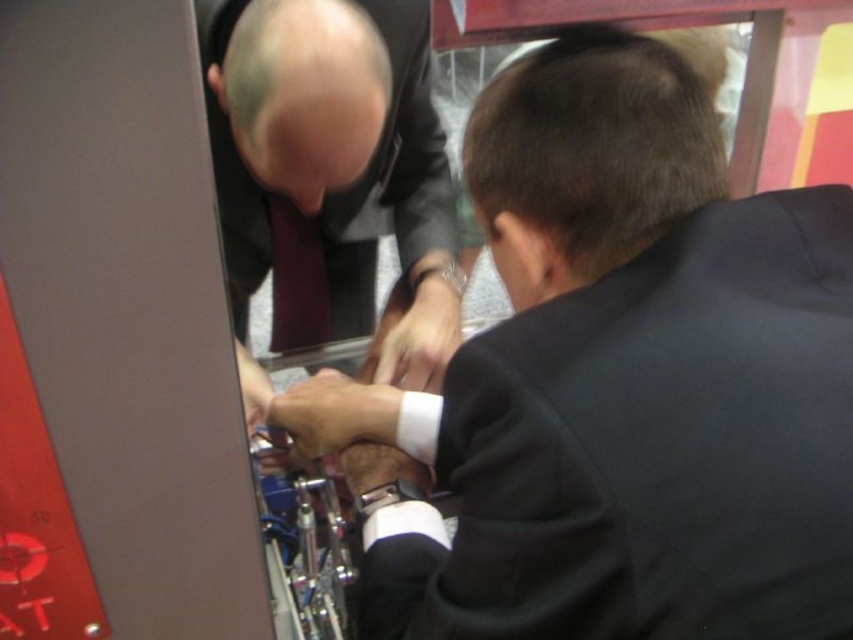
Question: Does shiny black suit at center come behind matte red tie at center?

Choices:
 (A) no
 (B) yes

Answer: (A)

Question: Which object appears farthest from the camera in this image?

Choices:
 (A) black suit at center
 (B) matte red tie at center

Answer: (B)

Question: Which point is closer to the camera?

Choices:
 (A) (514, 515)
 (B) (277, 340)
 (C) (451, 316)

Answer: (A)

Question: Is black suit at center to the right of shiny black suit at center from the viewer's perspective?

Choices:
 (A) no
 (B) yes

Answer: (B)

Question: Is shiny black suit at center thinner than matte red tie at center?

Choices:
 (A) yes
 (B) no

Answer: (B)

Question: Which point is farther from the camera taking this photo?

Choices:
 (A) (277, 218)
 (B) (657, 172)
 (C) (438, 129)

Answer: (C)